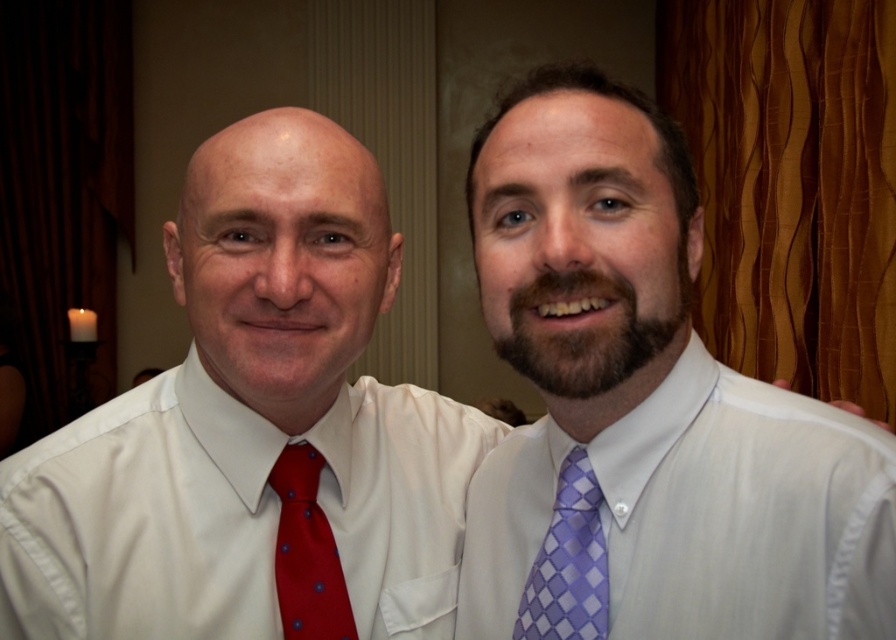
Between matte white shirt at center and polka dot silk tie at left, which one appears on the left side from the viewer's perspective?

polka dot silk tie at left is more to the left.

Is matte white shirt at center in front of polka dot silk tie at left?

Yes, it is.

Locate an element on the screen. Image resolution: width=896 pixels, height=640 pixels. matte white shirt at center is located at coordinates (231, 513).

This screenshot has width=896, height=640. I want to click on matte white shirt at center, so click(x=231, y=513).

Between purple checkered tie at center and polka dot silk tie at left, which one is positioned higher?

purple checkered tie at center is higher up.

Does purple checkered tie at center come behind polka dot silk tie at left?

No, it is in front of polka dot silk tie at left.

Who is more distant from viewer, (556, 500) or (298, 532)?

Positioned behind is point (298, 532).

This screenshot has height=640, width=896. I want to click on purple checkered tie at center, so click(567, 563).

Can you confirm if matte white shirt at center is smaller than white satin dress shirt at right?

No.

Can you confirm if matte white shirt at center is bigger than white satin dress shirt at right?

Indeed, matte white shirt at center has a larger size compared to white satin dress shirt at right.

Does point (266, 552) lie in front of point (676, 470)?

No, it is behind (676, 470).

The image size is (896, 640). I want to click on matte white shirt at center, so click(231, 513).